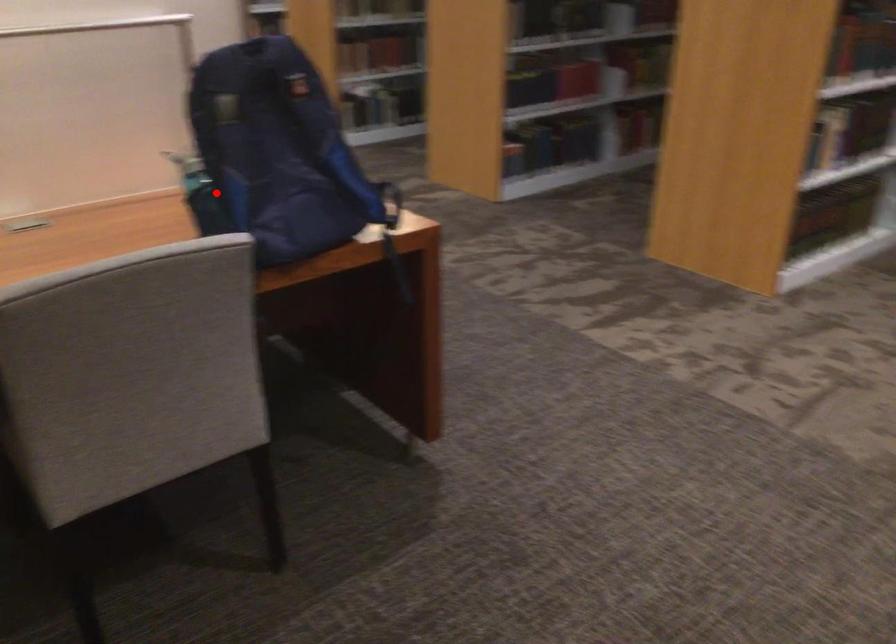
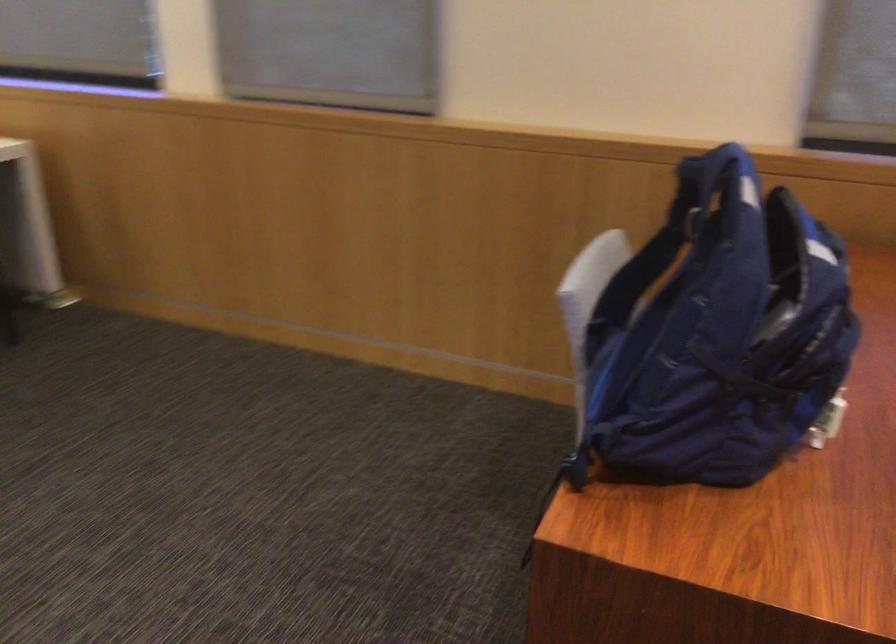
Locate, in the second image, the point that corresponds to the highlighted location in the first image.

(645, 285)